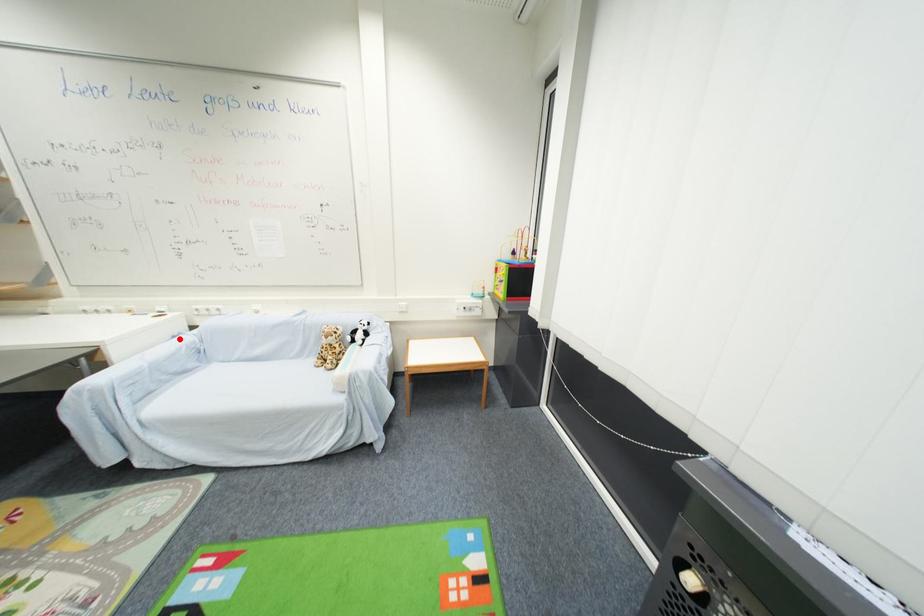
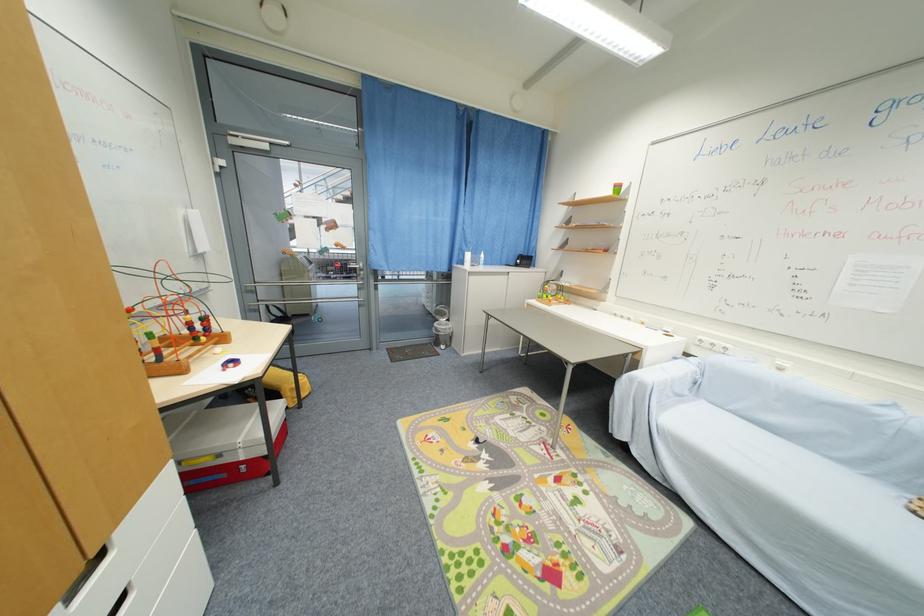
Question: A red point is marked in image1. In image2, is the corresponding 3D point closer to the camera or farther? Reply with the corresponding letter.

Choices:
 (A) The corresponding 3D point is closer.
 (B) The corresponding 3D point is farther.

Answer: (B)